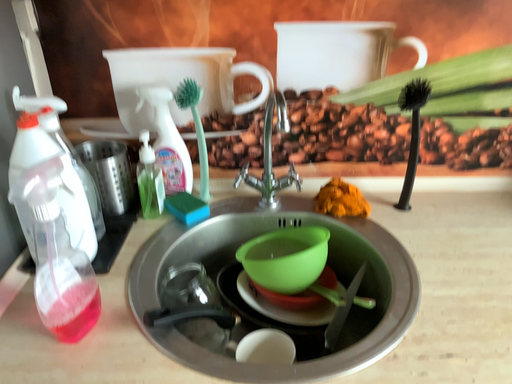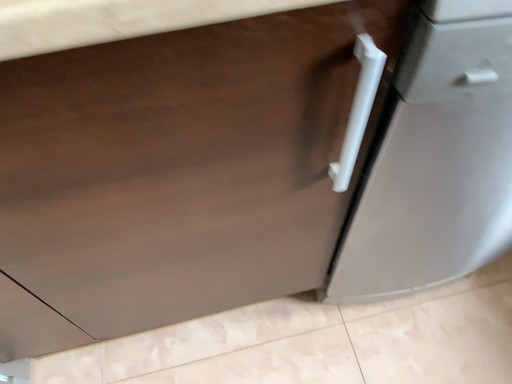
Question: How did the camera likely rotate when shooting the video?

Choices:
 (A) rotated upward
 (B) rotated downward

Answer: (B)